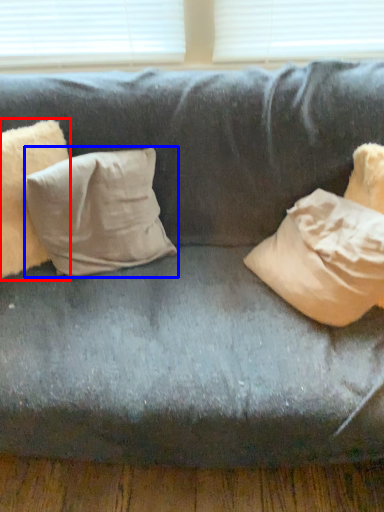
Question: Among these objects, which one is nearest to the camera, pillow (highlighted by a red box) or pillow (highlighted by a blue box)?

Choices:
 (A) pillow
 (B) pillow

Answer: (A)